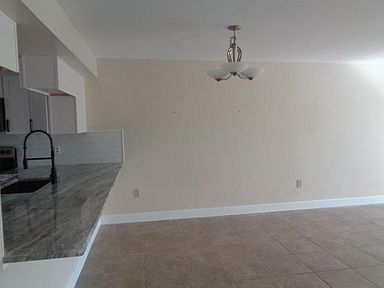
Find the location of a particular element. The image size is (384, 288). ceiling lamp is located at coordinates (234, 62).